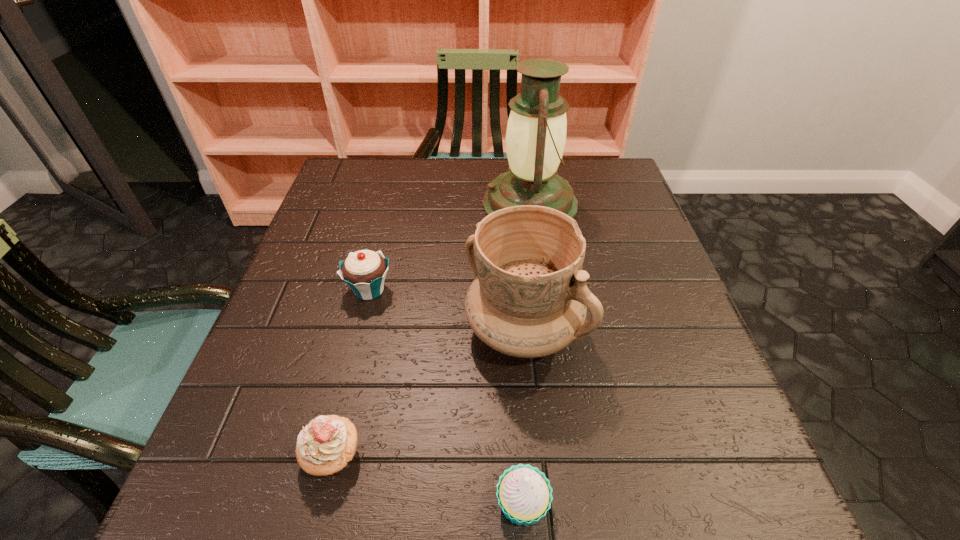
Where is `free space at the near left corner of the desktop`? This screenshot has height=540, width=960. free space at the near left corner of the desktop is located at coordinates (229, 469).

The height and width of the screenshot is (540, 960). I want to click on vacant region at the far right corner, so click(x=615, y=201).

Locate an element on the screen. This screenshot has height=540, width=960. free space at the near right corner of the desktop is located at coordinates (688, 475).

Identify the location of vacant area that lies between the farthest cupcake and the tallest object. Image resolution: width=960 pixels, height=540 pixels. (449, 247).

At what (x,y) coordinates should I click in order to perform the action: click on free space between the shortest cupcake and the pottery. Please return your answer as a coordinate pair (x, y). Image resolution: width=960 pixels, height=540 pixels. Looking at the image, I should click on (523, 417).

Locate an element on the screen. Image resolution: width=960 pixels, height=540 pixels. free space between the farthest cupcake and the lantern is located at coordinates (449, 247).

Where is `free spot between the fourth shortest object and the rightmost cupcake`? The width and height of the screenshot is (960, 540). free spot between the fourth shortest object and the rightmost cupcake is located at coordinates (523, 417).

This screenshot has width=960, height=540. In order to click on vacant area that lies between the lantern and the farthest cupcake in this screenshot , I will do `click(449, 247)`.

Find the location of a particular element. unoccupied area between the farthest cupcake and the pottery is located at coordinates (446, 310).

Locate which object ranks second in proximity to the farthest cupcake. Please provide its 2D coordinates. Your answer should be formatted as a tuple, i.e. [(x, y)], where the tuple contains the x and y coordinates of a point satisfying the conditions above.

[(536, 130)]